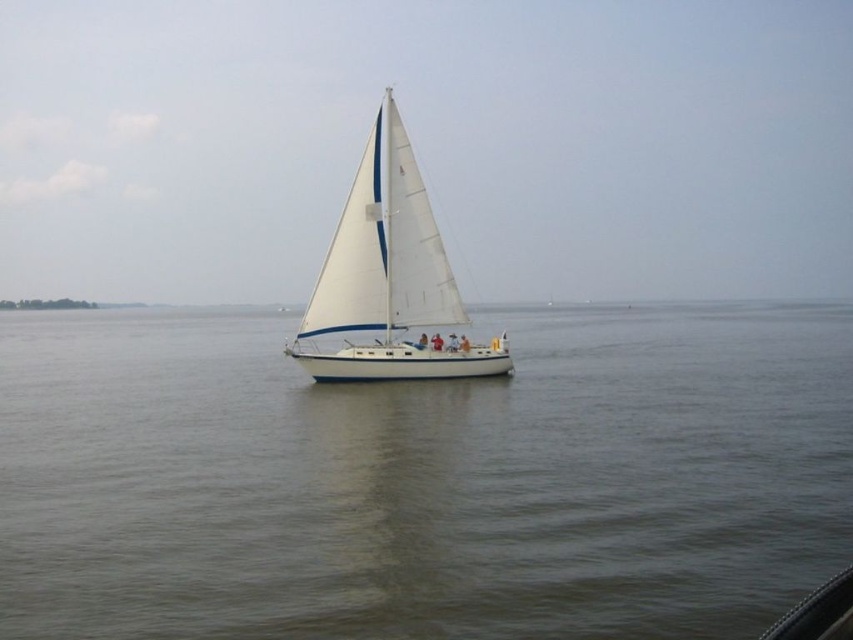
Is gray water at center taller than white matte sailboat at center?

Incorrect, gray water at center's height is not larger of white matte sailboat at center's.

Identify the location of gray water at center. This screenshot has height=640, width=853. (422, 477).